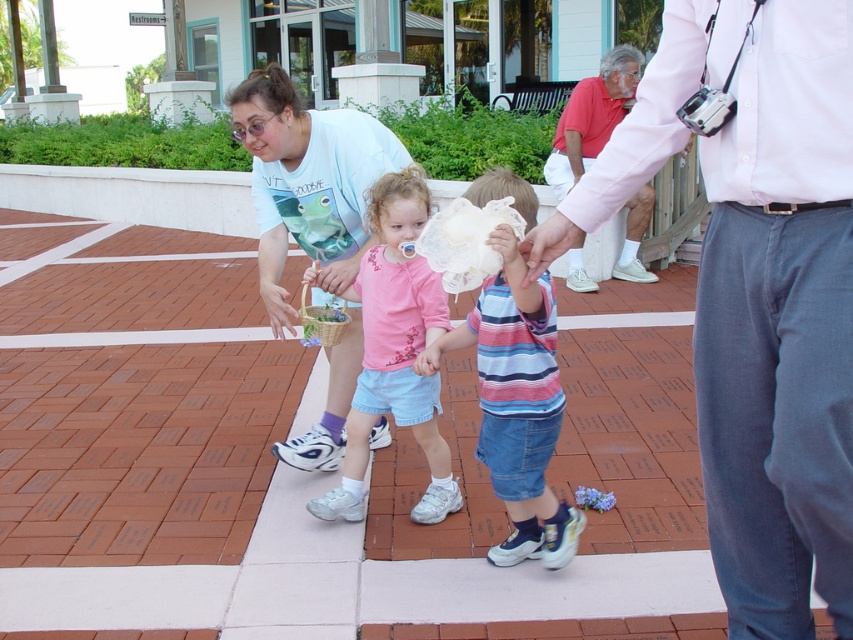
Who is positioned more to the left, matte pink shirt at upper right or light blue t-shirt at center?

light blue t-shirt at center

Is matte pink shirt at upper right to the left of light blue t-shirt at center from the viewer's perspective?

No, matte pink shirt at upper right is not to the left of light blue t-shirt at center.

I want to click on matte pink shirt at upper right, so click(757, 291).

Can you confirm if pink fabric shirt at center is thinner than red cotton shirt at upper right?

Correct, pink fabric shirt at center's width is less than red cotton shirt at upper right's.

Who is positioned more to the left, pink fabric shirt at center or red cotton shirt at upper right?

pink fabric shirt at center

Is point (338, 493) more distant than point (635, 228)?

No.

You are a GUI agent. You are given a task and a screenshot of the screen. Output one action in this format:
    pyautogui.click(x=<x>, y=<y>)
    Task: Click on the pink fabric shirt at center
    The width and height of the screenshot is (853, 640).
    Given the screenshot: What is the action you would take?
    pyautogui.click(x=395, y=349)

Which is below, matte pink shirt at upper right or red cotton shirt at upper right?

matte pink shirt at upper right

Can you confirm if matte pink shirt at upper right is positioned below red cotton shirt at upper right?

Yes.

Between point (845, 336) and point (564, 144), which one is positioned in front?

Positioned in front is point (845, 336).

The width and height of the screenshot is (853, 640). What are the coordinates of `matte pink shirt at upper right` in the screenshot? It's located at (757, 291).